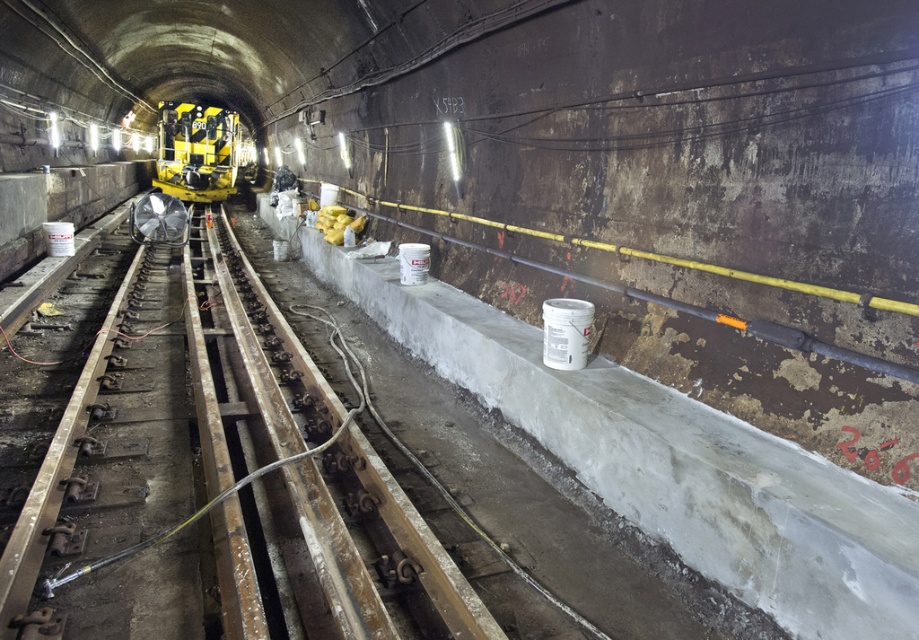
Which is behind, point (262, 392) or point (174, 147)?

Point (174, 147)

Can you confirm if rusty metal train track at center is positioned to the right of yellow matte subway at center?

Yes, rusty metal train track at center is to the right of yellow matte subway at center.

The width and height of the screenshot is (919, 640). In order to click on rusty metal train track at center in this screenshot , I will do `click(369, 552)`.

What are the coordinates of `rusty metal train track at center` in the screenshot? It's located at (369, 552).